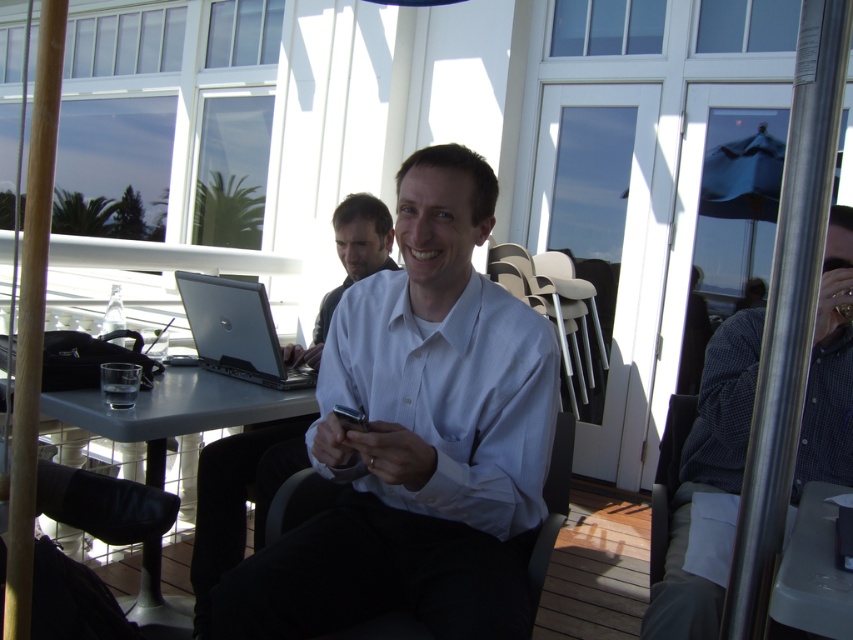
Image resolution: width=853 pixels, height=640 pixels. Describe the element at coordinates (418, 438) in the screenshot. I see `white smooth shirt at center` at that location.

What do you see at coordinates (418, 438) in the screenshot? Image resolution: width=853 pixels, height=640 pixels. I see `white smooth shirt at center` at bounding box center [418, 438].

Find the location of a particular element. The height and width of the screenshot is (640, 853). white smooth shirt at center is located at coordinates (418, 438).

Between checkered shirt at right and white glossy shirt at center, which one is positioned higher?

white glossy shirt at center is above.

Does checkered shirt at right appear on the right side of white glossy shirt at center?

Yes, checkered shirt at right is to the right of white glossy shirt at center.

Is point (798, 458) positioned before point (317, 314)?

Yes, it is.

At what (x,y) coordinates should I click in order to perform the action: click on checkered shirt at right. Please return your answer as a coordinate pair (x, y). This screenshot has height=640, width=853. Looking at the image, I should click on (708, 486).

Looking at this image, can you confirm if checkered shirt at right is wider than sleek silver laptop at center?

Yes, checkered shirt at right is wider than sleek silver laptop at center.

Which is behind, point (683, 516) or point (265, 385)?

The point (265, 385) is more distant.

This screenshot has width=853, height=640. What are the coordinates of `checkered shirt at right` in the screenshot? It's located at (708, 486).